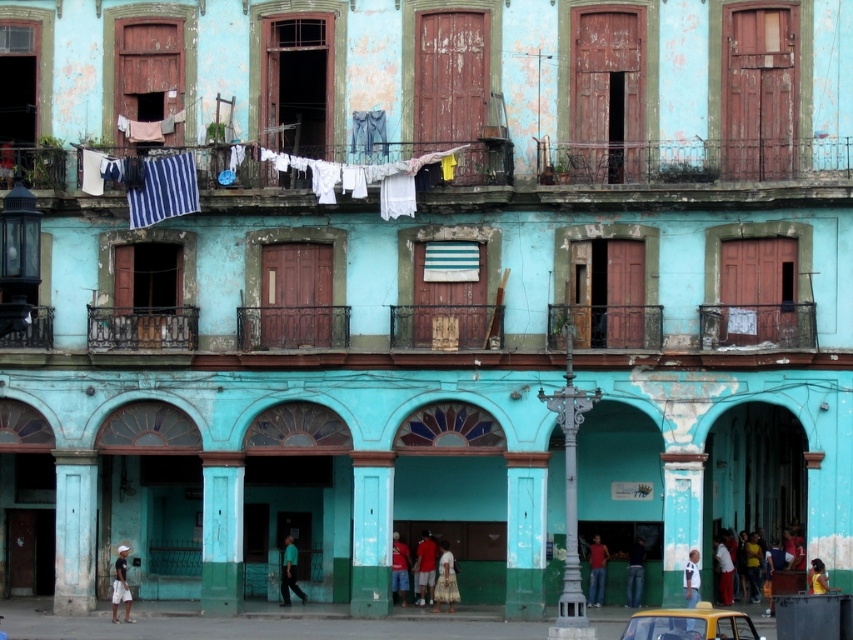
You are a photographer standing at the entrance of the building. You want to capture a photo of the red fabric pants at center. Based on their position, where should you aim your camera to ensure they are in the frame?

The red fabric pants at center are located at point 0.887 on the horizontal axis and 0.499 on the vertical axis. To capture them in the frame, aim your camera towards the upper right area of the building facade.

You are a tourist standing on the street below looking up at the building. You see the white fabric at upper center and the red shirt at center. Which one is higher up?

The white fabric at upper center is above the red shirt at center, so the white fabric at upper center is higher up.